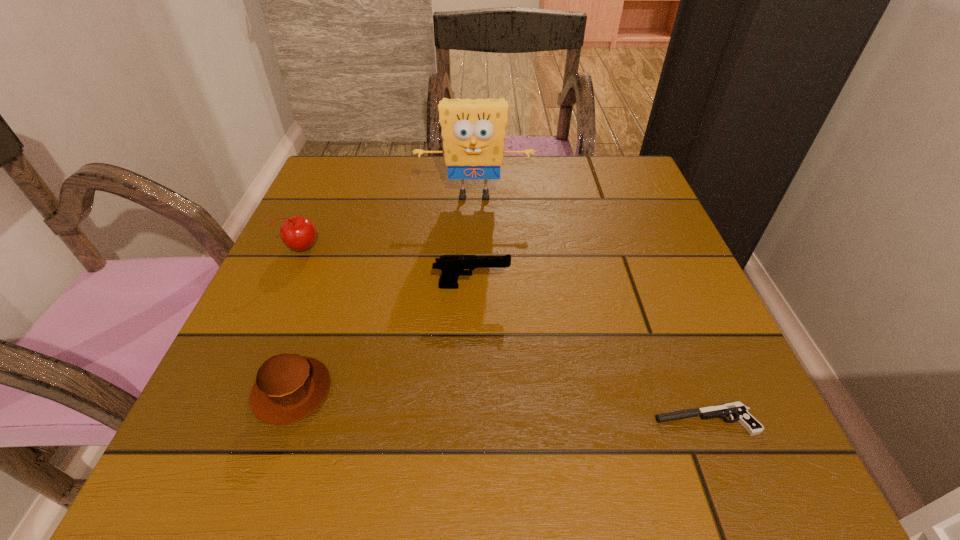
Image resolution: width=960 pixels, height=540 pixels. What are the coordinates of `empty space that is in between the taller pistol and the nearer pistol` in the screenshot? It's located at (588, 353).

This screenshot has width=960, height=540. I want to click on the second closest object relative to the fourth nearest object, so click(x=289, y=387).

This screenshot has height=540, width=960. Find the location of `the closest object to the nearer pistol`. the closest object to the nearer pistol is located at coordinates (452, 266).